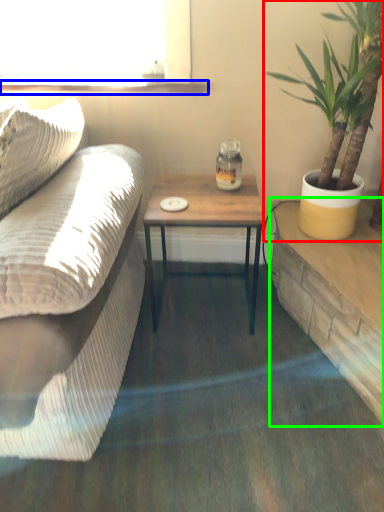
Question: Based on their relative distances, which object is farther from houseplant (highlighted by a red box)? Choose from window sill (highlighted by a blue box) and table (highlighted by a green box).

Choices:
 (A) window sill
 (B) table

Answer: (A)